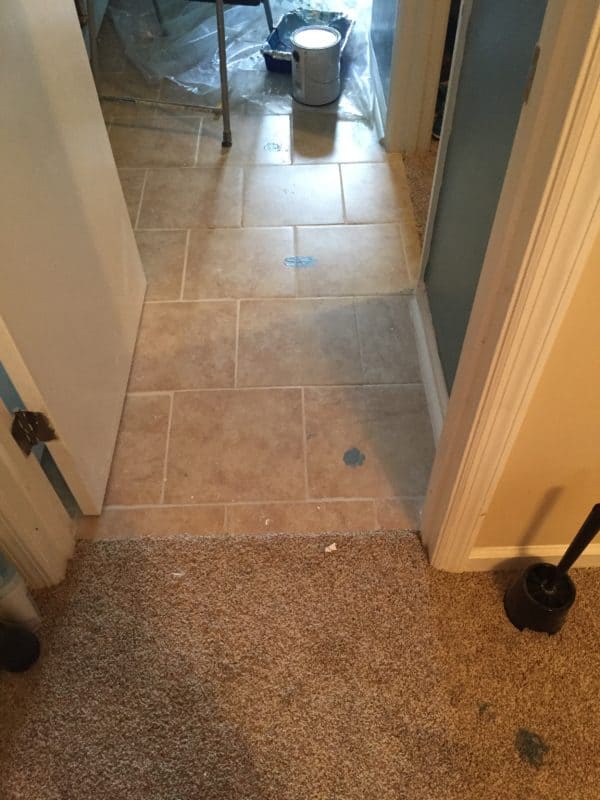
At what (x,y) coordinates should I click in order to perform the action: click on white door. Please return your answer as a coordinate pair (x, y). This screenshot has width=600, height=800. Looking at the image, I should click on (84, 374).